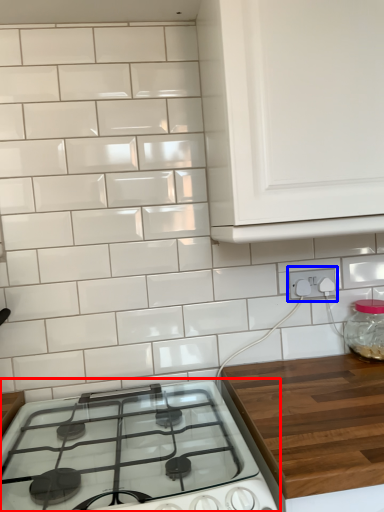
Question: Among these objects, which one is nearest to the camera, gas stove (highlighted by a red box) or electric outlet (highlighted by a blue box)?

Choices:
 (A) gas stove
 (B) electric outlet

Answer: (A)